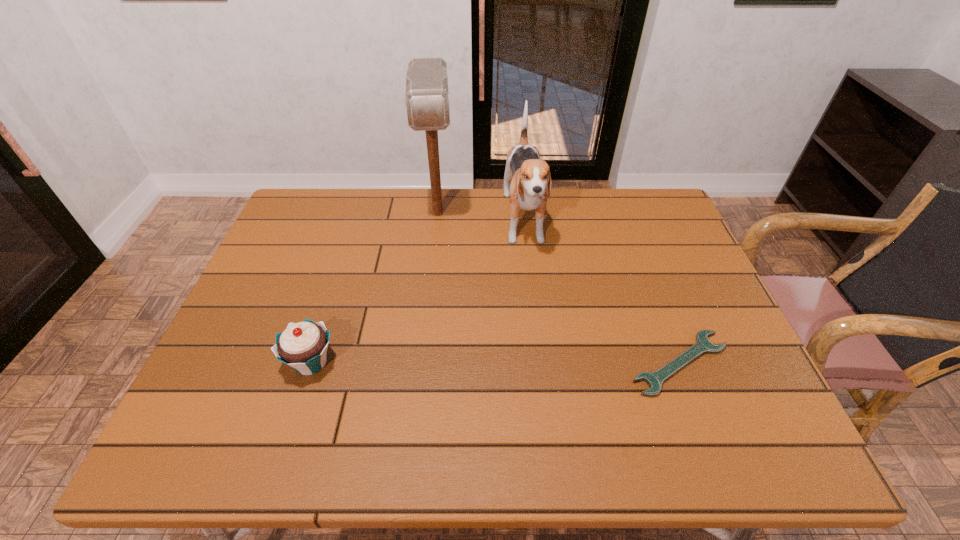
Where is `the leftmost object`? The width and height of the screenshot is (960, 540). the leftmost object is located at coordinates (303, 346).

Where is `cupcake`? The image size is (960, 540). cupcake is located at coordinates tap(303, 346).

The image size is (960, 540). I want to click on the shortest object, so click(x=702, y=345).

Where is `the rightmost object`? The image size is (960, 540). the rightmost object is located at coordinates (702, 345).

The height and width of the screenshot is (540, 960). In order to click on puppy in this screenshot , I will do `click(530, 176)`.

Locate an element on the screen. This screenshot has width=960, height=540. the third object from left to right is located at coordinates (530, 176).

Locate an element on the screen. mallet is located at coordinates coord(427,97).

At what (x,y) coordinates should I click in order to perform the action: click on the second object from left to right. Please return your answer as a coordinate pair (x, y). Looking at the image, I should click on (427, 97).

Where is `vacant space situated 0.110m on the left of the leftmost object`? The height and width of the screenshot is (540, 960). vacant space situated 0.110m on the left of the leftmost object is located at coordinates (237, 362).

This screenshot has height=540, width=960. In order to click on vacant space located 0.220m on the back of the shortest object in this screenshot , I will do `click(645, 271)`.